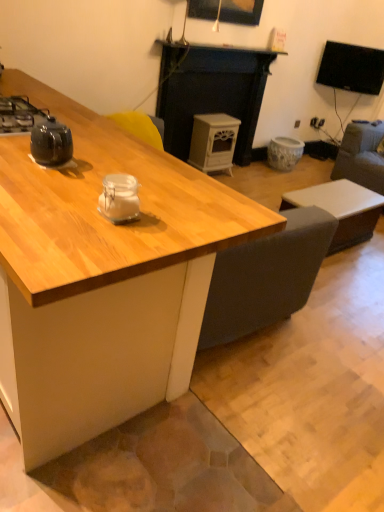
Identify the location of free space in front of matte black teapot at left. This screenshot has width=384, height=512. (46, 179).